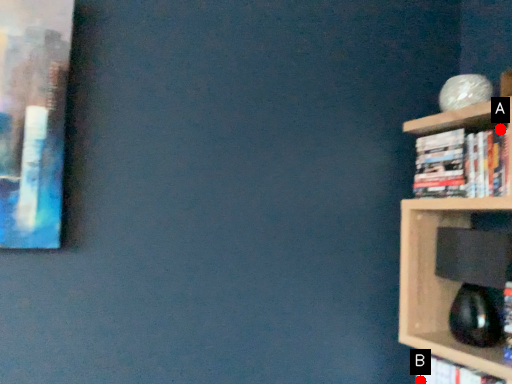
Question: Two points are circled on the image, labeled by A and B beside each circle. Which point is farther to the camera?

Choices:
 (A) A is further
 (B) B is further

Answer: (B)